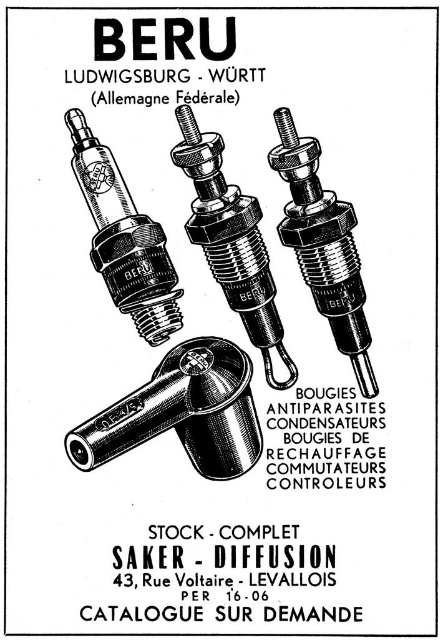
Can you confirm if metallic/smooth/valve at lower center is thinner than polished metal spark plug at upper left?

Incorrect, metallic/smooth/valve at lower center's width is not less than polished metal spark plug at upper left's.

Is the position of metallic/smooth/valve at lower center more distant than that of polished metal spark plug at upper left?

No, it is in front of polished metal spark plug at upper left.

What do you see at coordinates (182, 412) in the screenshot? I see `metallic/smooth/valve at lower center` at bounding box center [182, 412].

I want to click on metallic/smooth/valve at lower center, so click(x=182, y=412).

Can you confirm if metallic/smooth/valve at lower center is wider than matte silver spark plug at center?

Yes.

Between point (101, 460) and point (225, 218), which one is positioned behind?

The point (225, 218) is more distant.

Who is more distant from viewer, (212, 348) or (264, 324)?

Point (264, 324)

Locate an element on the screen. The image size is (443, 640). metallic/smooth/valve at lower center is located at coordinates (182, 412).

Which is behind, point (187, 125) or point (112, 218)?

Positioned behind is point (112, 218).

Which is more to the right, matte silver spark plug at center or polished metal spark plug at upper left?

matte silver spark plug at center is more to the right.

Who is more distant from viewer, (217, 156) or (147, 292)?

The point (147, 292) is behind.

Where is `matte silver spark plug at center`? The height and width of the screenshot is (640, 443). matte silver spark plug at center is located at coordinates (230, 241).